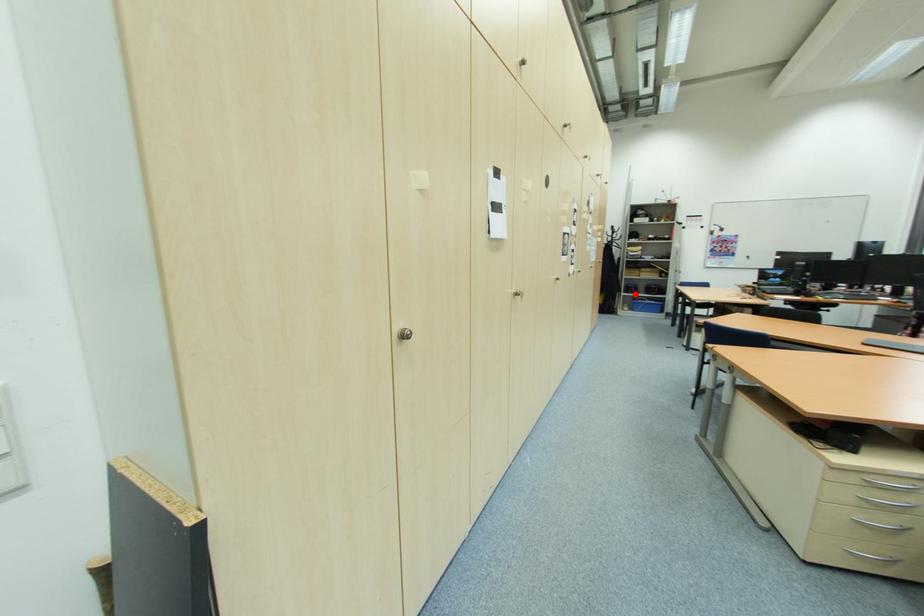
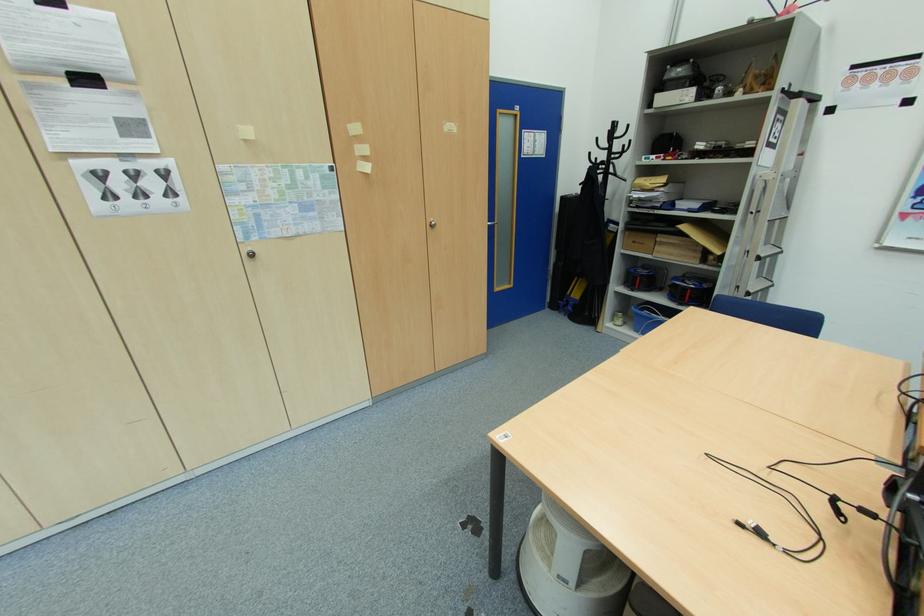
Question: A red point is marked in image1. In image2, is the corresponding 3D point closer to the camera or farther? Reply with the corresponding letter.

Choices:
 (A) The corresponding 3D point is closer.
 (B) The corresponding 3D point is farther.

Answer: (B)